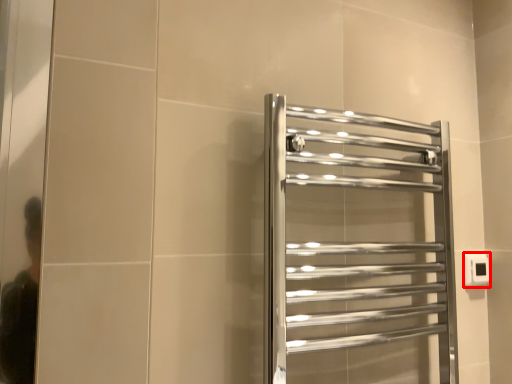
Question: Where is electric outlet (annotated by the red box) located in relation to towel rack in the image?

Choices:
 (A) left
 (B) right

Answer: (B)